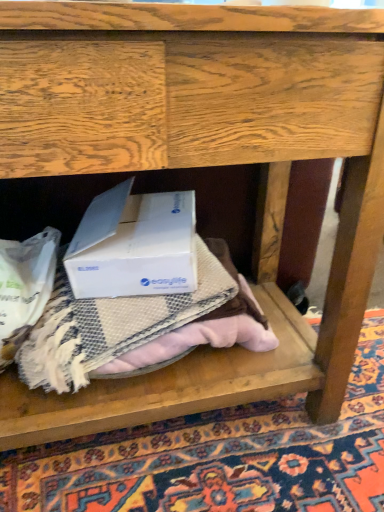
Question: Considering the relative sizes of white cardboard box at center and beige textured mat at center in the image provided, is white cardboard box at center bigger than beige textured mat at center?

Choices:
 (A) no
 (B) yes

Answer: (A)

Question: Is the depth of white cardboard box at center greater than that of beige textured mat at center?

Choices:
 (A) no
 (B) yes

Answer: (B)

Question: Is white cardboard box at center far from beige textured mat at center?

Choices:
 (A) no
 (B) yes

Answer: (A)

Question: From a real-world perspective, is white cardboard box at center physically below beige textured mat at center?

Choices:
 (A) no
 (B) yes

Answer: (A)

Question: Is beige textured mat at center a part of white cardboard box at center?

Choices:
 (A) no
 (B) yes

Answer: (A)

Question: In the image, is beige textured blanket at center positioned in front of or behind white cardboard box at center?

Choices:
 (A) front
 (B) behind

Answer: (B)

Question: Is beige textured blanket at center spatially inside white cardboard box at center, or outside of it?

Choices:
 (A) outside
 (B) inside

Answer: (A)

Question: Is beige textured blanket at center wider or thinner than white cardboard box at center?

Choices:
 (A) thin
 (B) wide

Answer: (B)

Question: From the image's perspective, is beige textured blanket at center positioned above or below white cardboard box at center?

Choices:
 (A) below
 (B) above

Answer: (A)

Question: From the image's perspective, is beige textured mat at center positioned above or below beige textured blanket at center?

Choices:
 (A) above
 (B) below

Answer: (A)

Question: Is beige textured mat at center taller or shorter than beige textured blanket at center?

Choices:
 (A) tall
 (B) short

Answer: (B)

Question: In the image, is beige textured mat at center positioned in front of or behind beige textured blanket at center?

Choices:
 (A) behind
 (B) front

Answer: (B)

Question: From a real-world perspective, is beige textured mat at center above or below beige textured blanket at center?

Choices:
 (A) above
 (B) below

Answer: (B)

Question: Considering the positions of beige textured blanket at center and beige textured mat at center in the image, is beige textured blanket at center taller or shorter than beige textured mat at center?

Choices:
 (A) tall
 (B) short

Answer: (A)

Question: From the image's perspective, is beige textured blanket at center above or below beige textured mat at center?

Choices:
 (A) below
 (B) above

Answer: (A)